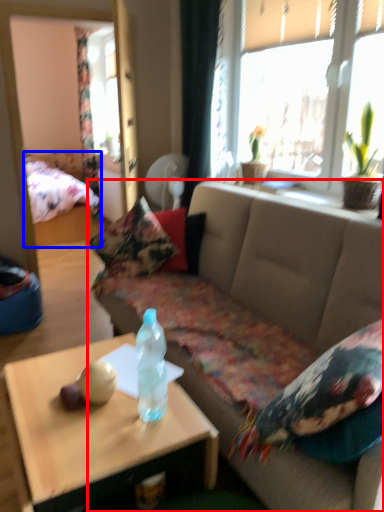
Question: Which of the following is the farthest to the observer, studio couch (highlighted by a red box) or bed (highlighted by a blue box)?

Choices:
 (A) studio couch
 (B) bed

Answer: (B)